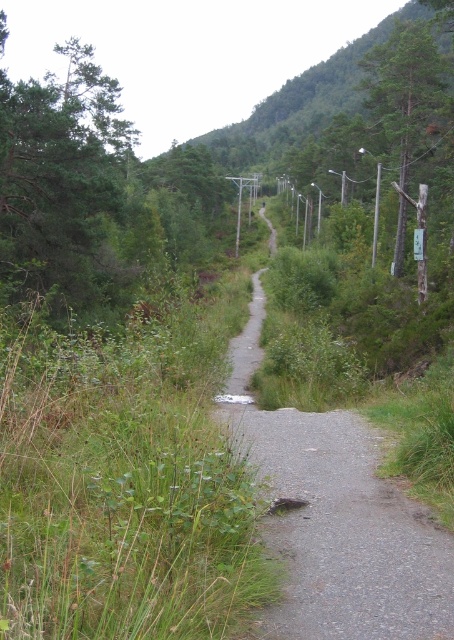
Question: Which of the following is the farthest from the observer?

Choices:
 (A) gray gravel path at center
 (B) green matte tree at upper right
 (C) green textured tree at upper left
 (D) smooth wooden post at right

Answer: (D)

Question: Which of the following is the farthest from the observer?

Choices:
 (A) green textured tree at upper left
 (B) smooth wooden post at right
 (C) green leafy hillside at upper center

Answer: (C)

Question: Does gray gravel path at center lie in front of green matte tree at upper right?

Choices:
 (A) no
 (B) yes

Answer: (B)

Question: Among these objects, which one is farthest from the camera?

Choices:
 (A) smooth wooden post at right
 (B) green leafy hillside at upper center

Answer: (B)

Question: Can you confirm if green textured tree at upper left is thinner than green leafy hillside at upper center?

Choices:
 (A) no
 (B) yes

Answer: (B)

Question: Can you confirm if green leafy hillside at upper center is thinner than green matte tree at upper right?

Choices:
 (A) yes
 (B) no

Answer: (B)